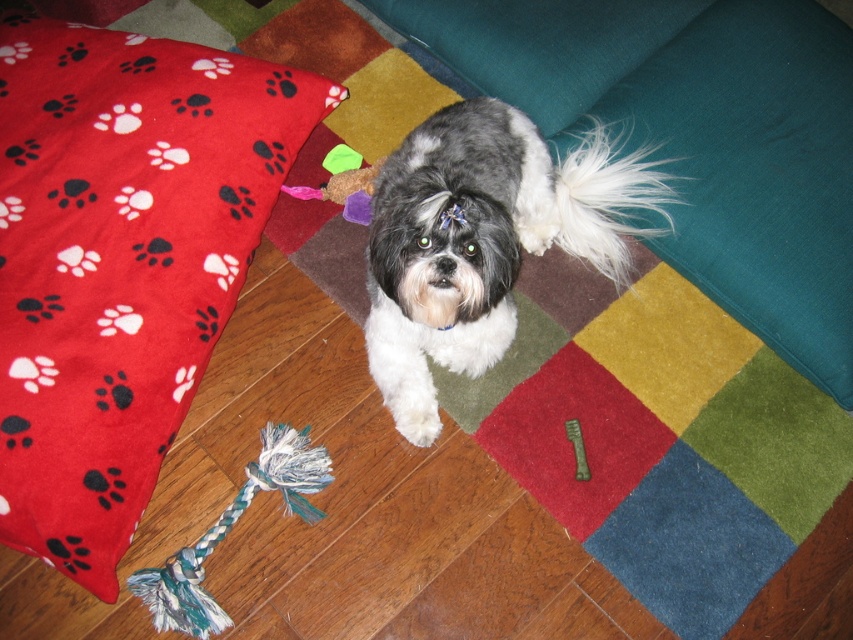
Which of these two, white fluffy tail at upper center or green metallic comb at lower center, stands taller?

white fluffy tail at upper center is taller.

Who is lower down, white fluffy tail at upper center or green metallic comb at lower center?

green metallic comb at lower center is lower down.

Which is behind, point (613, 257) or point (585, 467)?

Point (613, 257)

Find the location of a particular element. white fluffy tail at upper center is located at coordinates (606, 200).

Consider the image. Can you confirm if multicolored felt mat at center is bigger than red fleece throw pillow at lower left?

Yes, multicolored felt mat at center is bigger than red fleece throw pillow at lower left.

Is multicolored felt mat at center above red fleece throw pillow at lower left?

Incorrect, multicolored felt mat at center is not positioned above red fleece throw pillow at lower left.

The width and height of the screenshot is (853, 640). Describe the element at coordinates (538, 470) in the screenshot. I see `multicolored felt mat at center` at that location.

This screenshot has width=853, height=640. Find the location of `multicolored felt mat at center`. multicolored felt mat at center is located at coordinates (538, 470).

Is point (422, 336) farther from viewer compared to point (601, 134)?

No, it is in front of (601, 134).

Measure the distance between point (485, 353) and camera.

1.68 meters

You are a GUI agent. You are given a task and a screenshot of the screen. Output one action in this format:
    pyautogui.click(x=<x>, y=<y>)
    Task: Click on the black and white fur at center
    
    Given the screenshot: What is the action you would take?
    pyautogui.click(x=480, y=241)